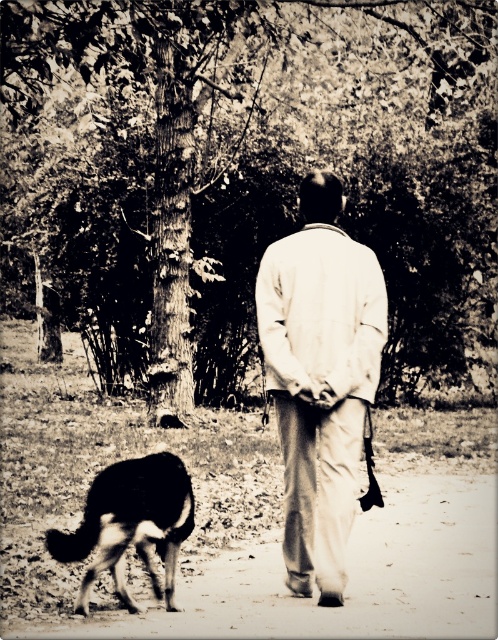
Question: Which point is closer to the camera taking this photo?

Choices:
 (A) (286, 452)
 (B) (105, 552)

Answer: (B)

Question: Does white cotton shirt at center have a lesser width compared to black fur dog at lower left?

Choices:
 (A) yes
 (B) no

Answer: (B)

Question: Which object appears closest to the camera in this image?

Choices:
 (A) black fur dog at lower left
 (B) white cotton shirt at center

Answer: (A)

Question: Does white cotton shirt at center appear under black fur dog at lower left?

Choices:
 (A) yes
 (B) no

Answer: (B)

Question: Does white cotton shirt at center appear under black fur dog at lower left?

Choices:
 (A) yes
 (B) no

Answer: (B)

Question: Which point is closer to the camera?

Choices:
 (A) (354, 390)
 (B) (136, 531)

Answer: (B)